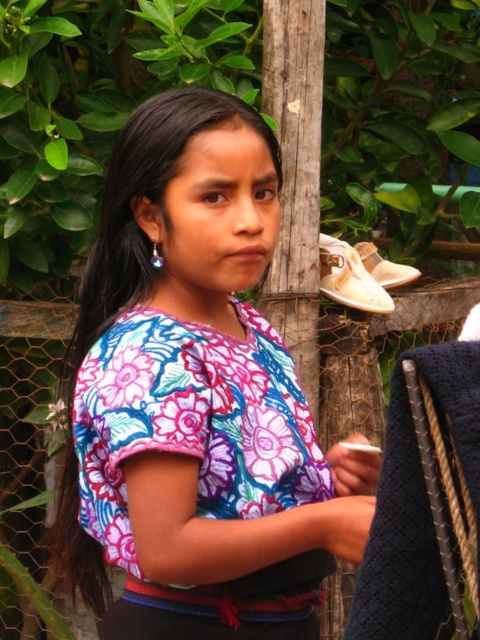
Is floral fabric shirt at center in front of light brown leather shoe at upper right?

Yes, it is.

Describe the element at coordinates (195, 396) in the screenshot. I see `floral fabric shirt at center` at that location.

The height and width of the screenshot is (640, 480). What are the coordinates of `floral fabric shirt at center` in the screenshot? It's located at (195, 396).

Can you confirm if floral fabric dress at center is wider than beige suede shoe at lower right?

Yes, floral fabric dress at center is wider than beige suede shoe at lower right.

Who is higher up, floral fabric dress at center or beige suede shoe at lower right?

beige suede shoe at lower right

Between point (222, 588) and point (389, 260), which one is positioned behind?

The point (389, 260) is behind.

I want to click on floral fabric dress at center, so click(x=201, y=454).

Consider the image. Between wooden post at center and light brown leather shoe at upper right, which one has less height?

Standing shorter between the two is light brown leather shoe at upper right.

Is wooden post at center positioned behind light brown leather shoe at upper right?

That is False.

Which is in front, point (300, 52) or point (333, 269)?

Positioned in front is point (300, 52).

You are a GUI agent. You are given a task and a screenshot of the screen. Output one action in this format:
    pyautogui.click(x=<x>, y=<y>)
    Task: Click on the wooden post at center
    This screenshot has height=640, width=480.
    Given the screenshot: What is the action you would take?
    pyautogui.click(x=296, y=177)